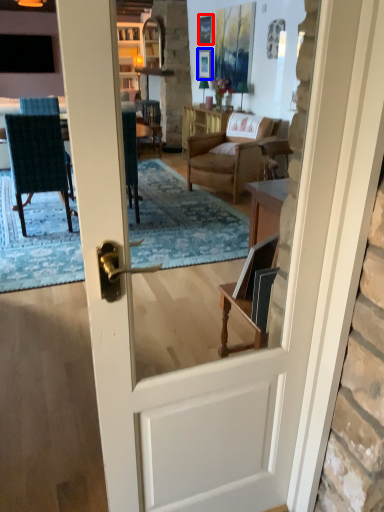
Question: Which point is closer to the camera, picture frame (highlighted by a red box) or picture frame (highlighted by a blue box)?

Choices:
 (A) picture frame
 (B) picture frame

Answer: (A)